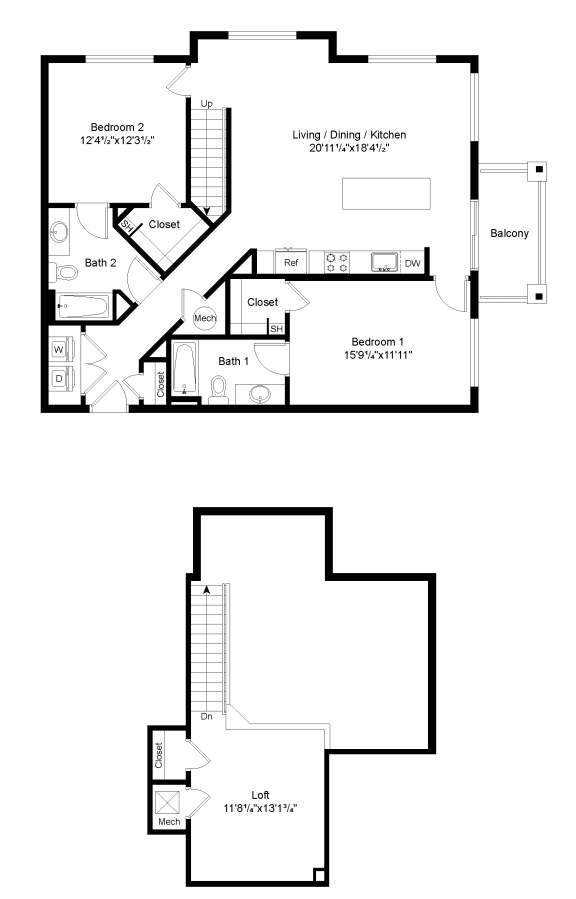
This screenshot has height=899, width=576. I want to click on laundry room, so [60, 360].